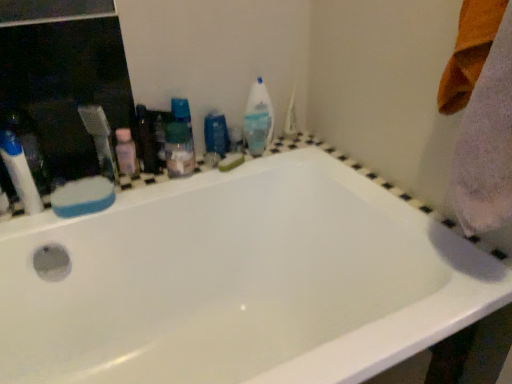
This screenshot has width=512, height=384. What are the coordinates of `translucent plastic toothbrush at left, marked as the 1th toiletry in a left-to-right arrangement` in the screenshot? It's located at (20, 172).

This screenshot has width=512, height=384. I want to click on blue glossy mouthwash at center, which appears as the first mouthwash when viewed from the back, so click(216, 134).

What is the approximate height of translucent plastic spray bottle at upper center?

It is 8.78 inches.

Image resolution: width=512 pixels, height=384 pixels. I want to click on white glossy bathtub at center, so click(240, 282).

Describe the element at coordinates (101, 140) in the screenshot. I see `white plastic toothbrush at left` at that location.

Where is `translucent plastic toothbrush at left, the 1th toiletry positioned from the front`? This screenshot has width=512, height=384. translucent plastic toothbrush at left, the 1th toiletry positioned from the front is located at coordinates (20, 172).

Is white plastic toothbrush at left positioned far away from blue glossy mouthwash at center, which appears as the first mouthwash when viewed from the back?

Actually, white plastic toothbrush at left and blue glossy mouthwash at center, which appears as the first mouthwash when viewed from the back, are a little close together.

Considering the positions of points (96, 143) and (229, 147), is point (96, 143) closer to camera compared to point (229, 147)?

Yes, point (96, 143) is closer to viewer.

From the image's perspective, is white plastic toothbrush at left located above blue glossy mouthwash at center, which appears as the first mouthwash when viewed from the back?

No, from the image's perspective, white plastic toothbrush at left is not on top of blue glossy mouthwash at center, which appears as the first mouthwash when viewed from the back.

In the scene shown: Is white plastic toothbrush at left looking in the opposite direction of white glossy bathtub at center?

white plastic toothbrush at left does not have its back to white glossy bathtub at center.

Is white plastic toothbrush at left taller than white glossy bathtub at center?

Incorrect, the height of white plastic toothbrush at left is not larger of that of white glossy bathtub at center.

Considering the sizes of white plastic toothbrush at left and white glossy bathtub at center in the image, is white plastic toothbrush at left wider or thinner than white glossy bathtub at center?

white plastic toothbrush at left is thinner than white glossy bathtub at center.

Locate an element on the screen. This screenshot has width=512, height=384. toothbrush above the white glossy bathtub at center (from a real-world perspective) is located at coordinates (101, 140).

Can you confirm if white glossy bathtub at center is shorter than blue sponge at upper left, the 1th soap viewed from the front?

No.

Looking at this image, from a real-world perspective, is white glossy bathtub at center under blue sponge at upper left, positioned as the 2th soap in back-to-front order?

Yes, from a real-world perspective, white glossy bathtub at center is below blue sponge at upper left, positioned as the 2th soap in back-to-front order.

Does white glossy bathtub at center lie behind translucent plastic spray bottle at upper center?

No, it is in front of translucent plastic spray bottle at upper center.

Who is bigger, white glossy bathtub at center or translucent plastic spray bottle at upper center?

Bigger between the two is white glossy bathtub at center.

Does white glossy bathtub at center appear on the right side of translucent plastic spray bottle at upper center?

No.

Can we say white glossy bathtub at center lies outside translucent plastic spray bottle at upper center?

white glossy bathtub at center lies outside translucent plastic spray bottle at upper center's area.

Which of these two, translucent plastic mouthwash at center, which is counted as the 1th mouthwash, starting from the front, or blue glossy mouthwash at center, marked as the second mouthwash in a front-to-back arrangement, is thinner?

blue glossy mouthwash at center, marked as the second mouthwash in a front-to-back arrangement, is thinner.

Which is less distant, (191, 135) or (226, 145)?

Point (191, 135) appears to be closer to the viewer than point (226, 145).

Is translucent plastic mouthwash at center, which is counted as the 1th mouthwash, starting from the front, spatially inside blue glossy mouthwash at center, which appears as the 2th mouthwash when viewed from the left, or outside of it?

translucent plastic mouthwash at center, which is counted as the 1th mouthwash, starting from the front, is outside blue glossy mouthwash at center, which appears as the 2th mouthwash when viewed from the left.

Is translucent plastic mouthwash at center, the 1th mouthwash from the left, facing towards blue glossy mouthwash at center, placed as the first mouthwash when sorted from right to left?

No, translucent plastic mouthwash at center, the 1th mouthwash from the left, is not facing towards blue glossy mouthwash at center, placed as the first mouthwash when sorted from right to left.

Is translucent plastic spray bottle at upper center to the left of white plastic toothbrush at left from the viewer's perspective?

Incorrect, translucent plastic spray bottle at upper center is not on the left side of white plastic toothbrush at left.

Which object is more forward, translucent plastic spray bottle at upper center or white plastic toothbrush at left?

white plastic toothbrush at left.

Would you say translucent plastic spray bottle at upper center is outside white plastic toothbrush at left?

Absolutely, translucent plastic spray bottle at upper center is external to white plastic toothbrush at left.

Which of these two, translucent plastic spray bottle at upper center or white plastic toothbrush at left, is bigger?

white plastic toothbrush at left.

You are a GUI agent. You are given a task and a screenshot of the screen. Output one action in this format:
    pyautogui.click(x=<x>, y=<y>)
    Task: Click on the bathtub to the right of blue glossy mouthwash at center, placed as the first mouthwash when sorted from right to left
    This screenshot has height=384, width=512.
    Given the screenshot: What is the action you would take?
    pyautogui.click(x=240, y=282)

Is blue glossy mouthwash at center, which appears as the first mouthwash when viewed from the back, wider or thinner than white glossy bathtub at center?

blue glossy mouthwash at center, which appears as the first mouthwash when viewed from the back, is thinner than white glossy bathtub at center.

Choose the correct answer: Is blue glossy mouthwash at center, which appears as the first mouthwash when viewed from the back, inside white glossy bathtub at center or outside it?

blue glossy mouthwash at center, which appears as the first mouthwash when viewed from the back, is spatially situated outside white glossy bathtub at center.

Is blue glossy mouthwash at center, placed as the first mouthwash when sorted from right to left, at the right side of white glossy bathtub at center?

In fact, blue glossy mouthwash at center, placed as the first mouthwash when sorted from right to left, is to the left of white glossy bathtub at center.

Image resolution: width=512 pixels, height=384 pixels. What are the coordinates of `toothbrush below the blue glossy mouthwash at center, placed as the first mouthwash when sorted from right to left (from the image's perspective)` in the screenshot? It's located at (101, 140).

Where is `toothbrush behind the white glossy bathtub at center`? This screenshot has height=384, width=512. toothbrush behind the white glossy bathtub at center is located at coordinates (101, 140).

Looking at the image, which one is located further to pink plastic bottle at upper left, which is the 1th toiletry from right to left, white plastic toothbrush at left or green sponge at upper center, the 1th soap in the back-to-front sequence?

Answer: green sponge at upper center, the 1th soap in the back-to-front sequence.

Estimate the real-world distances between objects in this image. Which object is closer to white glossy bathtub at center, translucent plastic mouthwash at center, placed as the 2th mouthwash when sorted from right to left, or green sponge at upper center, the 1th soap when ordered from top to bottom?

translucent plastic mouthwash at center, placed as the 2th mouthwash when sorted from right to left, is positioned closer to the anchor white glossy bathtub at center.

Estimate the real-world distances between objects in this image. Which object is further from translucent plastic toothbrush at left, marked as the 2th toiletry in a back-to-front arrangement, blue glossy mouthwash at center, which appears as the 2th mouthwash when viewed from the left, or pink plastic bottle at upper left, the first toiletry when ordered from back to front?

blue glossy mouthwash at center, which appears as the 2th mouthwash when viewed from the left, lies further to translucent plastic toothbrush at left, marked as the 2th toiletry in a back-to-front arrangement, than the other object.

Estimate the real-world distances between objects in this image. Which object is closer to white plastic toothbrush at left, blue glossy mouthwash at center, marked as the second mouthwash in a front-to-back arrangement, or green sponge at upper center, the 1th soap in the back-to-front sequence?

Among the two, blue glossy mouthwash at center, marked as the second mouthwash in a front-to-back arrangement, is located nearer to white plastic toothbrush at left.

Looking at this image, looking at the image, which one is located further to translucent plastic toothbrush at left, arranged as the second toiletry when viewed from the right, white plastic toothbrush at left or blue glossy mouthwash at center, marked as the second mouthwash in a front-to-back arrangement?

The object further to translucent plastic toothbrush at left, arranged as the second toiletry when viewed from the right, is blue glossy mouthwash at center, marked as the second mouthwash in a front-to-back arrangement.

Which object lies further to the anchor point translucent plastic spray bottle at upper center, white plastic toothbrush at left or translucent plastic mouthwash at center, the 1th mouthwash from the left?

white plastic toothbrush at left is positioned further to the anchor translucent plastic spray bottle at upper center.

From the picture: Looking at the image, which one is located further to translucent plastic spray bottle at upper center, pink plastic bottle at upper left, the second toiletry positioned from the front, or white glossy bathtub at center?

white glossy bathtub at center lies further to translucent plastic spray bottle at upper center than the other object.

Estimate the real-world distances between objects in this image. Which object is closer to translucent plastic toothbrush at left, the 1th toiletry positioned from the front, translucent plastic mouthwash at center, the second mouthwash in the back-to-front sequence, or blue glossy mouthwash at center, marked as the second mouthwash in a front-to-back arrangement?

translucent plastic mouthwash at center, the second mouthwash in the back-to-front sequence, is positioned closer to the anchor translucent plastic toothbrush at left, the 1th toiletry positioned from the front.

The image size is (512, 384). In order to click on toothbrush between translucent plastic toothbrush at left, marked as the 1th toiletry in a left-to-right arrangement, and translucent plastic spray bottle at upper center from left to right in this screenshot , I will do `click(101, 140)`.

Identify the location of soap between white glossy bathtub at center and pink plastic bottle at upper left, which is the 1th toiletry from right to left, along the z-axis. The height and width of the screenshot is (384, 512). (83, 197).

Locate an element on the screen. toothbrush situated between translucent plastic toothbrush at left, arranged as the second toiletry when viewed from the right, and blue glossy mouthwash at center, marked as the second mouthwash in a front-to-back arrangement, from left to right is located at coordinates point(101,140).

Locate an element on the screen. The height and width of the screenshot is (384, 512). toiletry between translucent plastic toothbrush at left, marked as the 1th toiletry in a left-to-right arrangement, and green sponge at upper center, which ranks as the second soap in front-to-back order, from left to right is located at coordinates (126, 153).